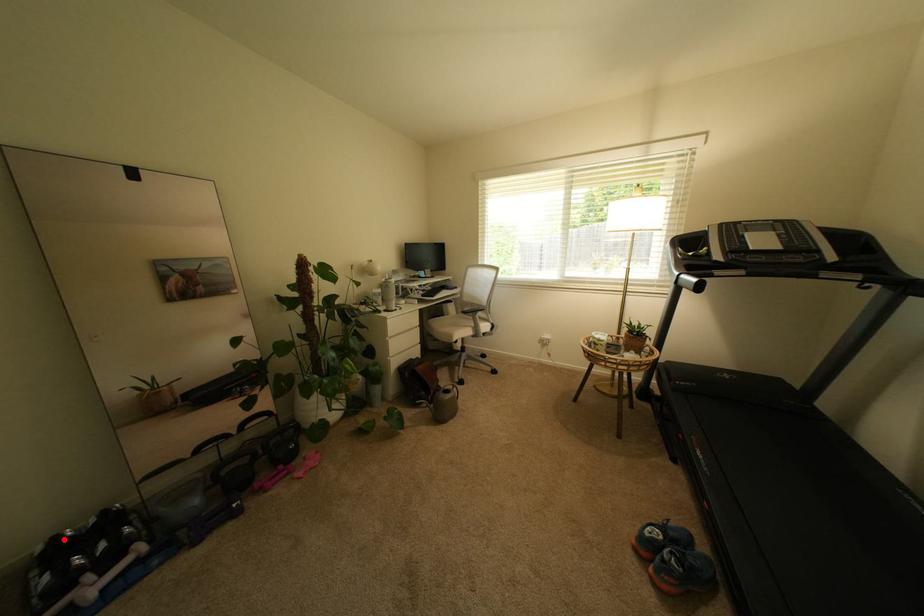
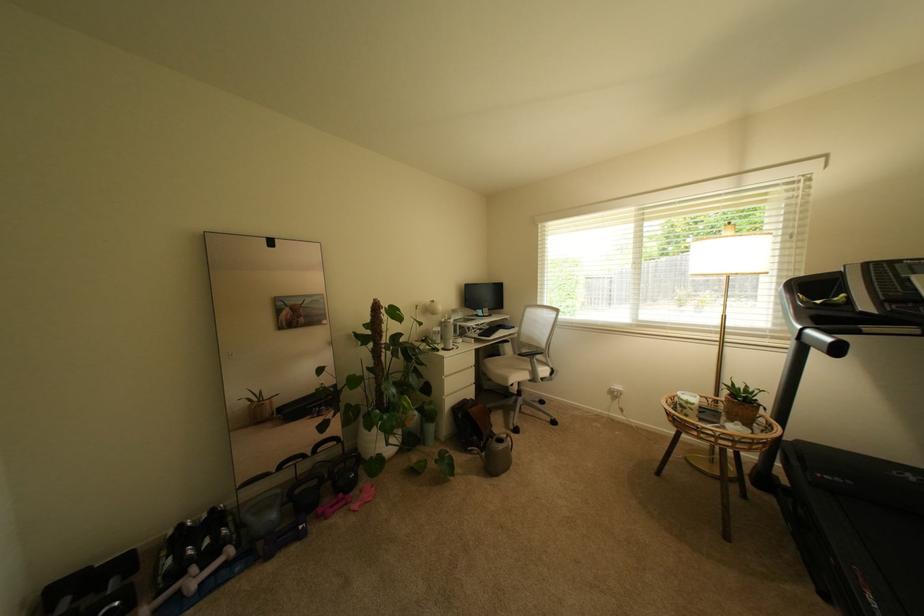
Locate, in the second image, the point that corresponds to the highlighted location in the first image.

(188, 527)